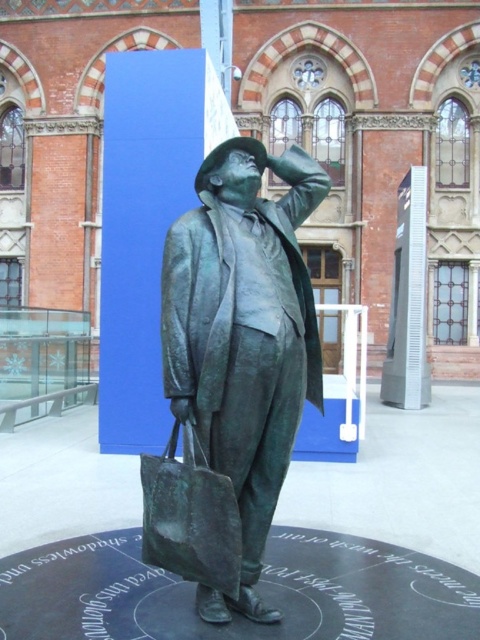
You are a tour guide leading a group and want to ensure that the bronze statue at center and the green patina bag at center are visible to everyone. The minimum distance required for clear viewing between two objects is 20 inches. Is the current spacing between them sufficient?

The bronze statue at center and the green patina bag at center are 22.84 inches apart from each other, which exceeds the minimum required distance of 20 inches. Therefore, the current spacing is sufficient for clear viewing.

You are standing at the camera position and want to reach the point marked as point (x=238, y=426). If your walking speed is 3 feet per second, how many seconds will it take you to reach the point?

The distance between point (x=238, y=426) and the camera is 13.41 feet. At a speed of 3 feet per second, it would take 13.41 divided by 3, which is approximately 4.47 seconds to reach the point.

You are standing at point (242,337) in the courtyard. What object is located exactly at your current position?

The bronze statue at center is located exactly at point (242,337).